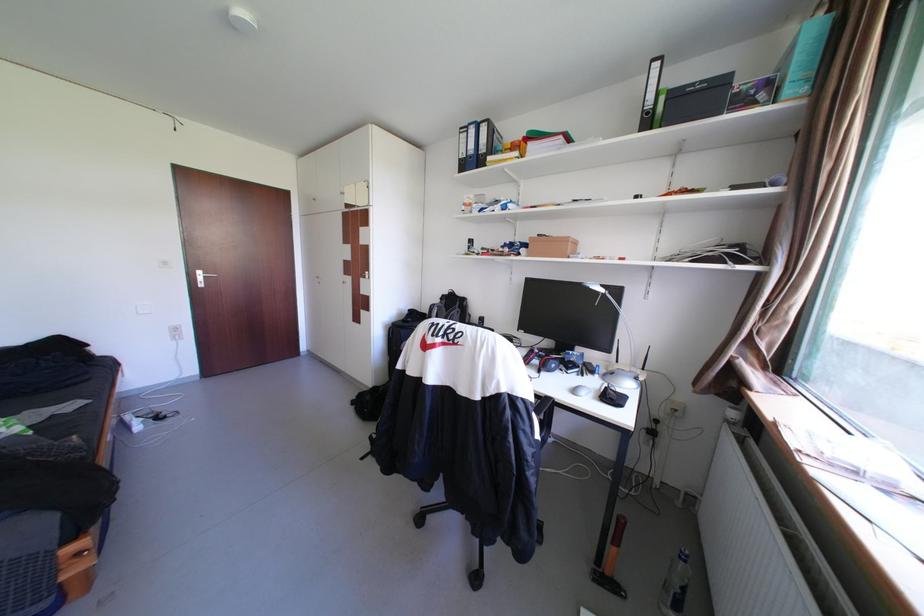
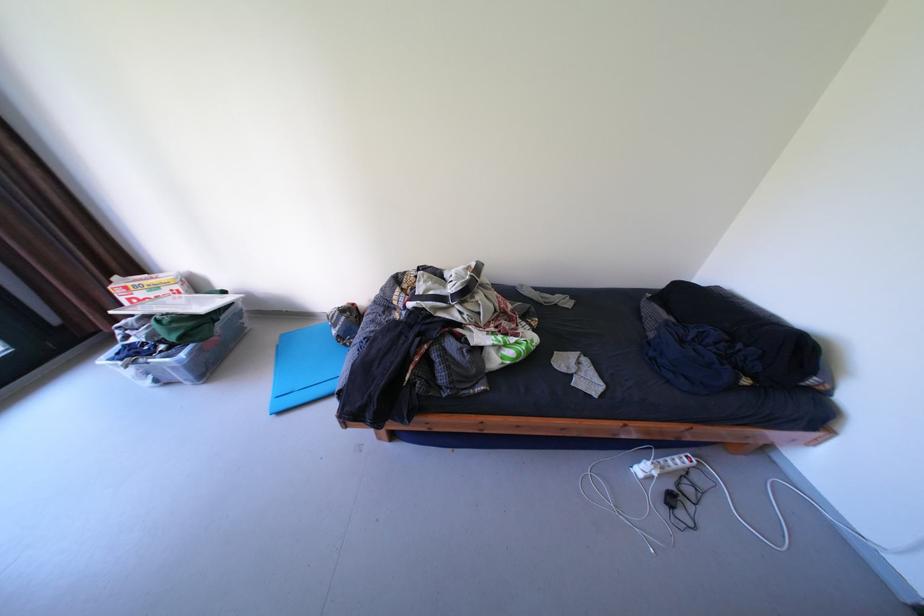
Locate, in the second image, the point that corresponds to [149,428] in the first image.

(649, 471)